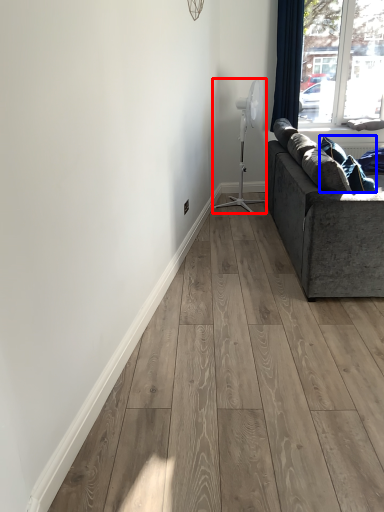
Question: Among these objects, which one is nearest to the camera, fan (highlighted by a red box) or pillow (highlighted by a blue box)?

Choices:
 (A) fan
 (B) pillow

Answer: (B)